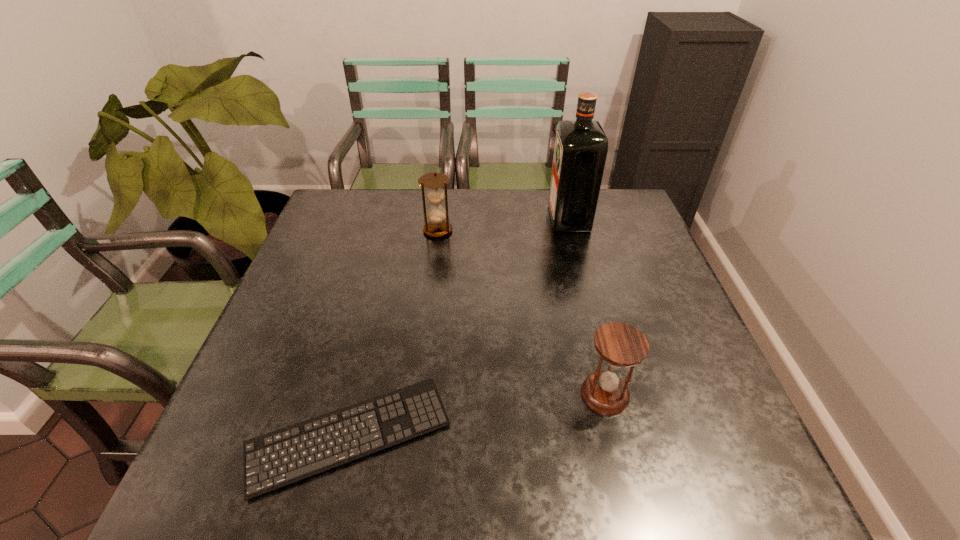
Find the location of a particular element. The width and height of the screenshot is (960, 540). free region at the far right corner of the desktop is located at coordinates (628, 195).

Where is `vacant space at the near right corner of the desktop`? The width and height of the screenshot is (960, 540). vacant space at the near right corner of the desktop is located at coordinates (735, 481).

I want to click on vacant area that lies between the computer keyboard and the liquor, so click(x=459, y=327).

At what (x,y) coordinates should I click in order to perform the action: click on vacant area that lies between the tallest object and the shortest object. Please return your answer as a coordinate pair (x, y). The image size is (960, 540). Looking at the image, I should click on (459, 327).

The image size is (960, 540). I want to click on free spot between the nearer hourglass and the tallest object, so click(588, 307).

The image size is (960, 540). Identify the location of vacant space that is in between the right hourglass and the left hourglass. click(x=521, y=312).

Find the location of a particular element. vacant area that lies between the left hourglass and the tallest object is located at coordinates (503, 225).

Where is `vacant region between the liquor and the shortest object`? This screenshot has width=960, height=540. vacant region between the liquor and the shortest object is located at coordinates pos(459,327).

Identify the location of vacant space that's between the nearer hourglass and the left hourglass. (521, 312).

Find the location of a particular element. This screenshot has width=960, height=540. vacant space that is in between the nearer hourglass and the farther hourglass is located at coordinates (521, 312).